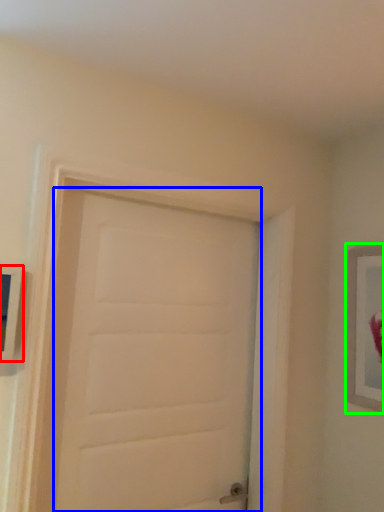
Question: Considering the real-world distances, which object is closest to picture frame (highlighted by a red box)? door (highlighted by a blue box) or picture frame (highlighted by a green box).

Choices:
 (A) door
 (B) picture frame

Answer: (A)